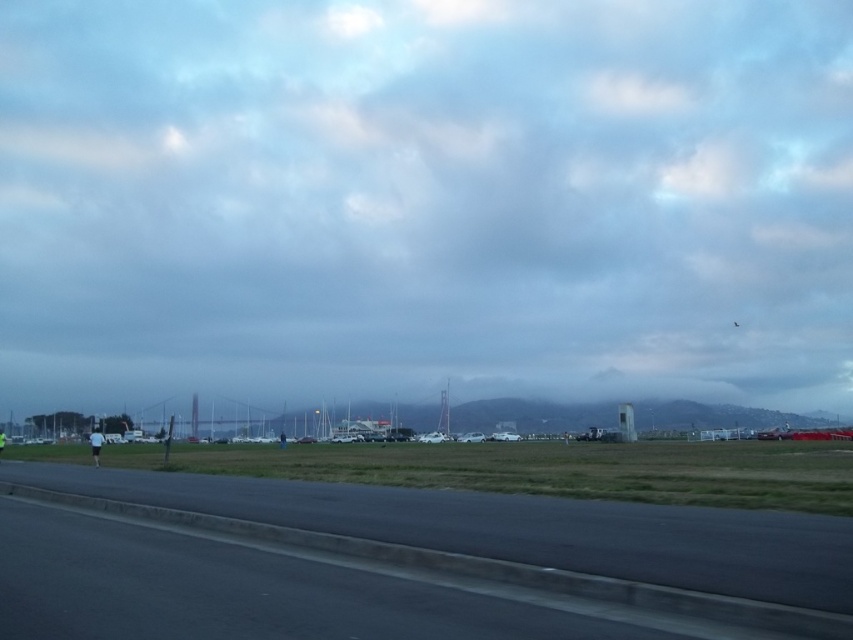
Question: Which object is closer to the camera taking this photo?

Choices:
 (A) cloudy sky at upper center
 (B) black asphalt runway at lower left

Answer: (B)

Question: Does cloudy sky at upper center appear on the left side of black asphalt runway at lower left?

Choices:
 (A) yes
 (B) no

Answer: (B)

Question: Is cloudy sky at upper center in front of black asphalt runway at lower left?

Choices:
 (A) yes
 (B) no

Answer: (B)

Question: Can you confirm if cloudy sky at upper center is bigger than black asphalt runway at lower left?

Choices:
 (A) no
 (B) yes

Answer: (B)